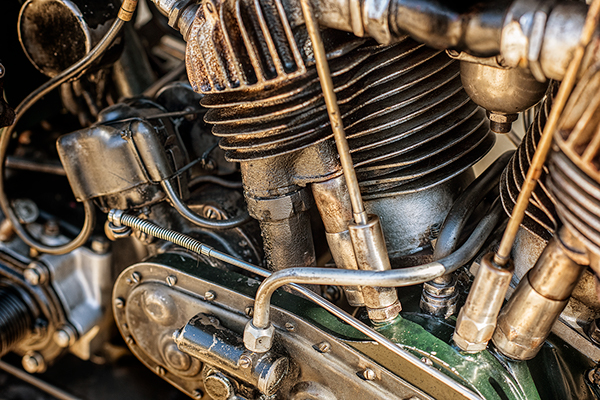
This screenshot has width=600, height=400. I want to click on screen, so click(60, 43).